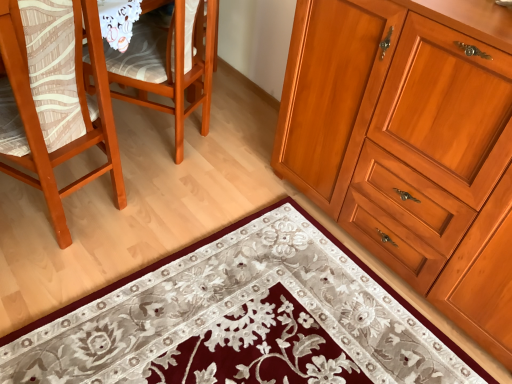
Question: Is wooden cabinet at right bigger or smaller than matte wood chair at left, arranged as the 1th chair when viewed from the left?

Choices:
 (A) big
 (B) small

Answer: (A)

Question: From a real-world perspective, relative to matte wood chair at left, the second chair when ordered from right to left, is wooden cabinet at right vertically above or below?

Choices:
 (A) above
 (B) below

Answer: (A)

Question: Which of these objects is positioned farthest from the wooden chair at left, placed as the 2th chair when sorted from left to right?

Choices:
 (A) wooden cabinet at right
 (B) floral carpet at lower center
 (C) matte wood chair at left, arranged as the 1th chair when viewed from the left

Answer: (B)

Question: Estimate the real-world distances between objects in this image. Which object is farther from the matte wood chair at left, the second chair when ordered from right to left?

Choices:
 (A) wooden cabinet at right
 (B) wooden chair at left, the 1th chair viewed from the right
 (C) floral carpet at lower center

Answer: (A)